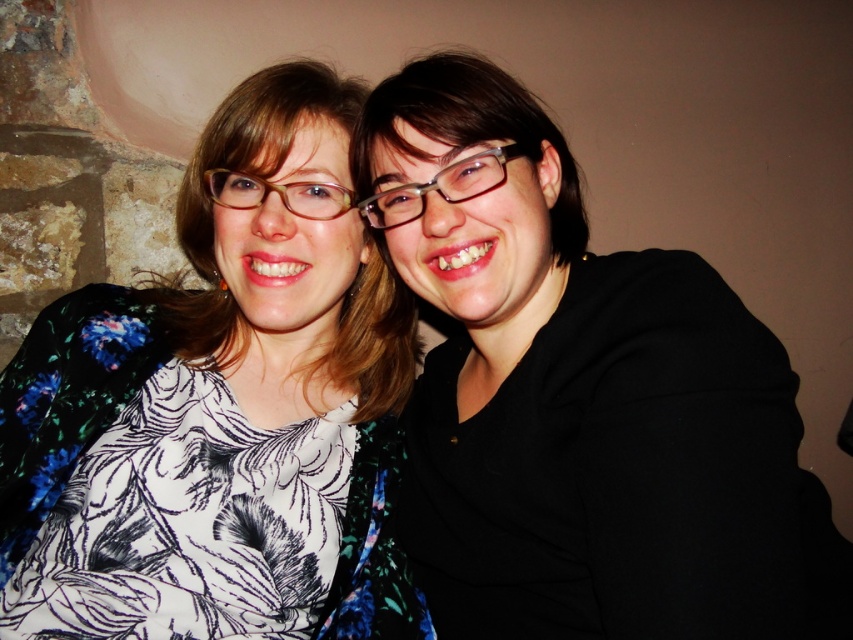
Question: Does black matte jacket at right lie behind floral-patterned blouse at center?

Choices:
 (A) no
 (B) yes

Answer: (A)

Question: Can you confirm if black matte jacket at right is wider than floral-patterned blouse at center?

Choices:
 (A) no
 (B) yes

Answer: (B)

Question: Is black matte jacket at right to the left of floral-patterned blouse at center from the viewer's perspective?

Choices:
 (A) no
 (B) yes

Answer: (A)

Question: Among these points, which one is farthest from the camera?

Choices:
 (A) (483, 188)
 (B) (341, 99)

Answer: (B)